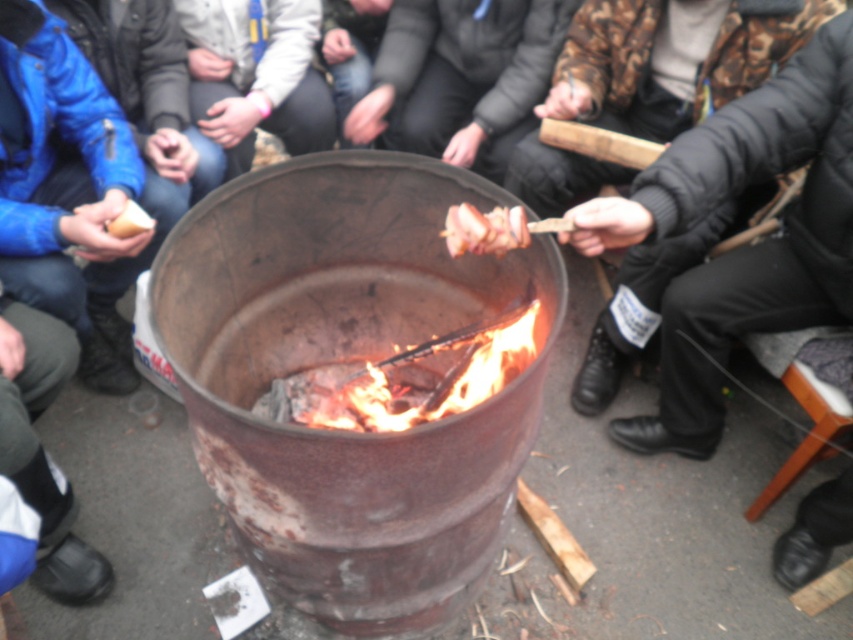
Who is taller, charcoal wood at center or brown wooden skewer at center?

With more height is charcoal wood at center.

Which is above, charcoal wood at center or brown wooden skewer at center?

brown wooden skewer at center is above.

This screenshot has width=853, height=640. Describe the element at coordinates (403, 380) in the screenshot. I see `charcoal wood at center` at that location.

At what (x,y) coordinates should I click in order to perform the action: click on charcoal wood at center. Please return your answer as a coordinate pair (x, y). This screenshot has height=640, width=853. Looking at the image, I should click on (403, 380).

Between black puffy jacket at upper right and matte brown bread at left, which one appears on the left side from the viewer's perspective?

matte brown bread at left

Who is shorter, black puffy jacket at upper right or matte brown bread at left?

With less height is matte brown bread at left.

Between point (764, 305) and point (135, 228), which one is positioned behind?

Point (135, 228)

At what (x,y) coordinates should I click in order to perform the action: click on black puffy jacket at upper right. Please return your answer as a coordinate pair (x, y). Looking at the image, I should click on (741, 248).

Does charcoal wood at center have a smaller size compared to matte brown bread at left?

No, charcoal wood at center is not smaller than matte brown bread at left.

Does charcoal wood at center have a greater height compared to matte brown bread at left?

Yes.

Who is more distant from viewer, (474,353) or (108,230)?

Positioned behind is point (108,230).

You are a GUI agent. You are given a task and a screenshot of the screen. Output one action in this format:
    pyautogui.click(x=<x>, y=<y>)
    Task: Click on the charcoal wood at center
    This screenshot has width=853, height=640.
    Given the screenshot: What is the action you would take?
    pyautogui.click(x=403, y=380)